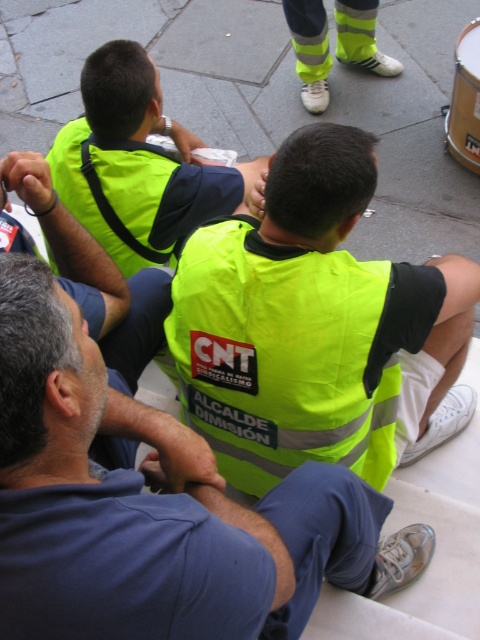
You are standing in a public gathering where three men in yellow safety vests are protesting. There is a point at coordinates point (365, 269). Can you walk up to that point from where you are standing? Explain your reasoning.

The distance between point (365, 269) and the viewer is 5.49 feet. Since this distance is walkable, you can walk up to that point from where you are standing.

You are a photographer trying to capture a candid shot of the two individuals wearing the high visibility vest at center and the yellow reflective vest at center. Given that your camera has a maximum focus range of 12 inches, can you photograph both subjects clearly without moving closer?

The distance between the high visibility vest at center and yellow reflective vest at center is 13.30 inches. Since this exceeds the camera lens maximum focus range of 12 inches, you cannot capture both subjects clearly without moving closer.

Based on the scene description, which object is positioned higher between the high visibility vest at center and the neon yellow vest at upper center?

The neon yellow vest at upper center is positioned higher than the high visibility vest at center.